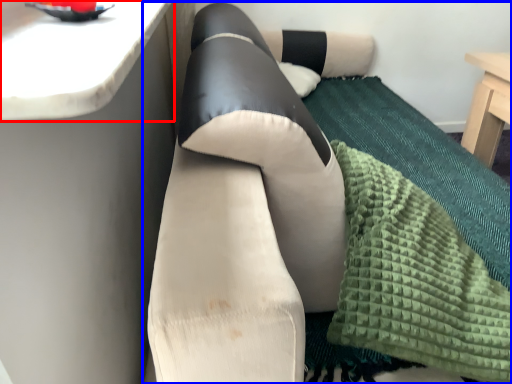
Question: Among these objects, which one is nearest to the camera, counter top (highlighted by a red box) or studio couch (highlighted by a blue box)?

Choices:
 (A) counter top
 (B) studio couch

Answer: (A)